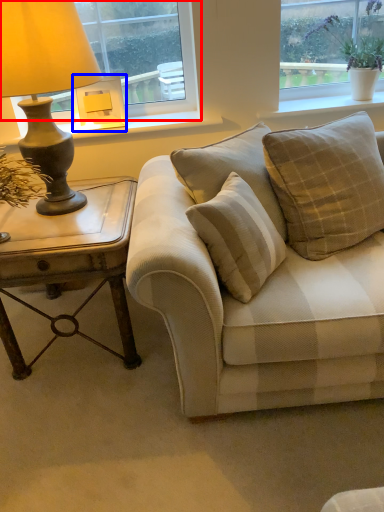
Question: Which point is further to the camera, window (highlighted by a red box) or lamp (highlighted by a blue box)?

Choices:
 (A) window
 (B) lamp

Answer: (B)